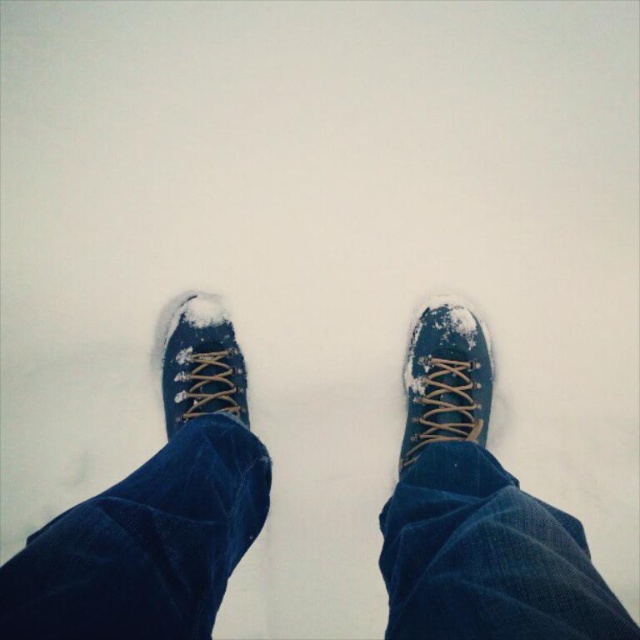
Question: Does blue suede shoe at center have a smaller size compared to blue canvas shoe at center?

Choices:
 (A) no
 (B) yes

Answer: (B)

Question: Based on their relative distances, which object is farther from the blue canvas shoe at center?

Choices:
 (A) blue canvas shoes at center
 (B) blue suede shoe at center

Answer: (B)

Question: Is blue canvas shoes at center positioned at the back of blue canvas shoe at center?

Choices:
 (A) no
 (B) yes

Answer: (A)

Question: Which point is closer to the camera?

Choices:
 (A) blue suede shoe at center
 (B) blue canvas shoes at center
 (C) blue canvas shoe at center

Answer: (B)

Question: Is the position of blue canvas shoes at center less distant than that of blue suede shoe at center?

Choices:
 (A) yes
 (B) no

Answer: (A)

Question: Which point appears closest to the camera in this image?

Choices:
 (A) (205, 298)
 (B) (212, 381)
 (C) (480, 384)

Answer: (B)